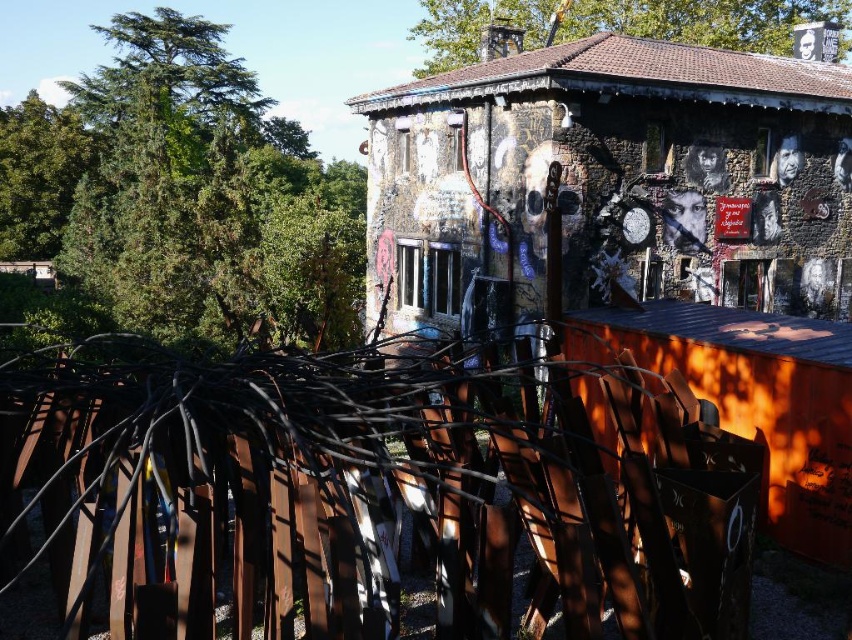
You are standing at the entrance of the dilapidated building and want to reach the rusty metal fence at center. According to the coordinates provided, in which direction should you move relative to your current position?

The rusty metal fence at center is located at coordinates point (355, 493). Since the coordinate system typically places (0, 0) at the bottom left corner, moving towards higher x values means moving to the right and higher y values mean moving upwards. Therefore, to reach the rusty metal fence at center, you should move to the right and upwards from your current position at the entrance.

You are standing at the origin point of the image. Where is the rusty metal fence at center located in terms of coordinates?

The rusty metal fence at center is located at coordinates point (x=355, y=493).